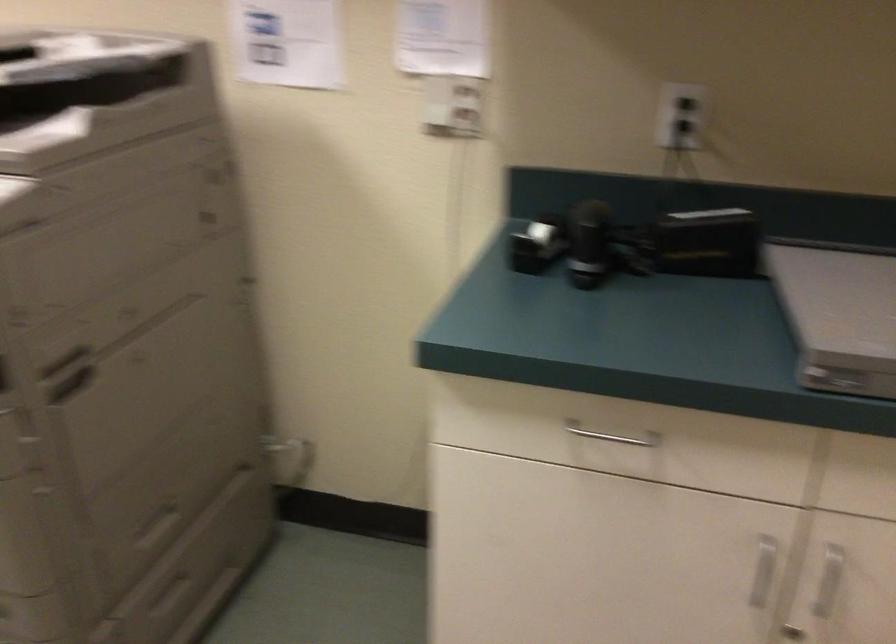
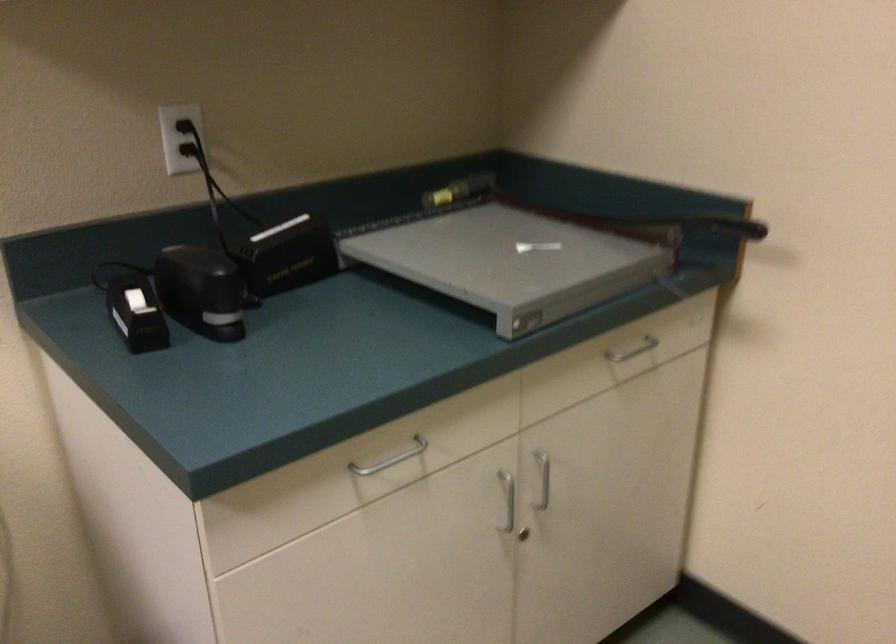
Where in the second image is the point corresponding to [586,238] from the first image?

(202, 290)